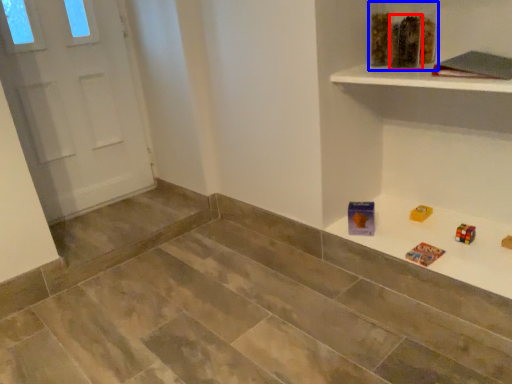
Question: Which point is closer to the camera, toy (highlighted by a red box) or toy (highlighted by a blue box)?

Choices:
 (A) toy
 (B) toy

Answer: (A)